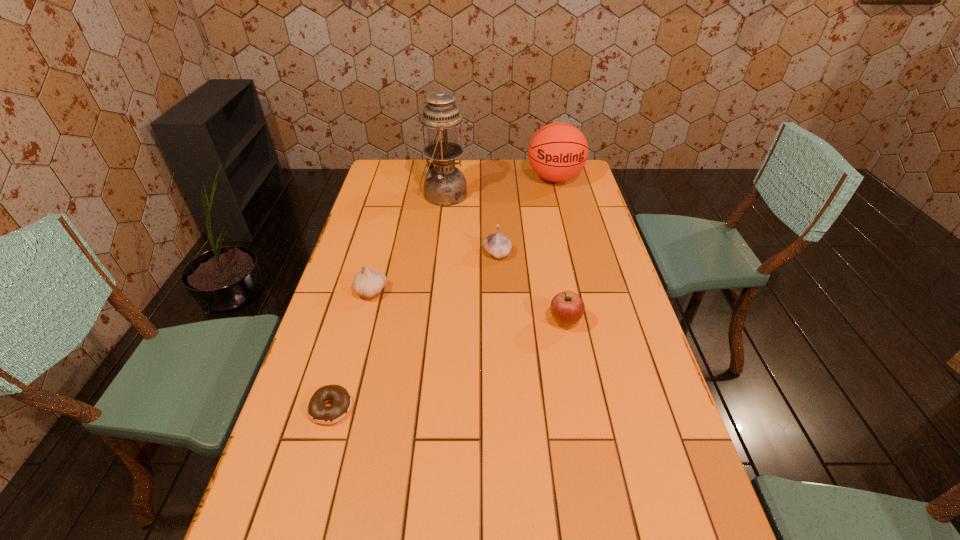
The height and width of the screenshot is (540, 960). What are the coordinates of `free space between the fourth object from left to right and the fifth farthest object` in the screenshot? It's located at (531, 287).

Find the location of a particular element. The height and width of the screenshot is (540, 960). object that stands as the fifth closest to the apple is located at coordinates (558, 151).

I want to click on object identified as the fourth closest to the basketball, so click(368, 283).

The width and height of the screenshot is (960, 540). I want to click on the second closest garlic to the tallest object, so click(368, 283).

This screenshot has width=960, height=540. I want to click on garlic that can be found as the closest to the tallest object, so click(x=496, y=244).

Where is `free space that satisfies the following two spatial constraints: 1. on the back side of the right garlic; 2. on the right side of the shortest object`? This screenshot has height=540, width=960. free space that satisfies the following two spatial constraints: 1. on the back side of the right garlic; 2. on the right side of the shortest object is located at coordinates (375, 253).